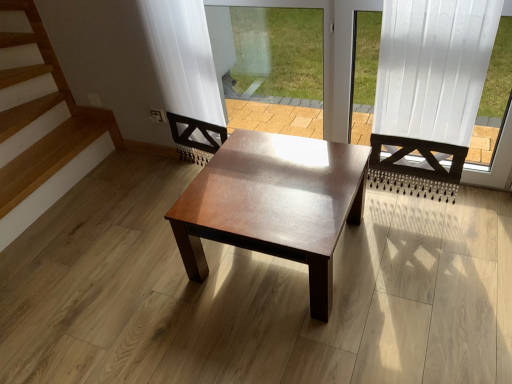
Question: From a real-world perspective, is white wood frame at upper right physically located above or below shiny brown wood coffee table at center?

Choices:
 (A) below
 (B) above

Answer: (B)

Question: Would you say white wood frame at upper right is inside or outside shiny brown wood coffee table at center?

Choices:
 (A) outside
 (B) inside

Answer: (A)

Question: Which object is the farthest from the shiny brown wood coffee table at center?

Choices:
 (A) transparent glass window screen at center
 (B) white wood frame at upper right

Answer: (A)

Question: Which of these objects is positioned farthest from the white wood frame at upper right?

Choices:
 (A) shiny brown wood coffee table at center
 (B) transparent glass window screen at center

Answer: (A)